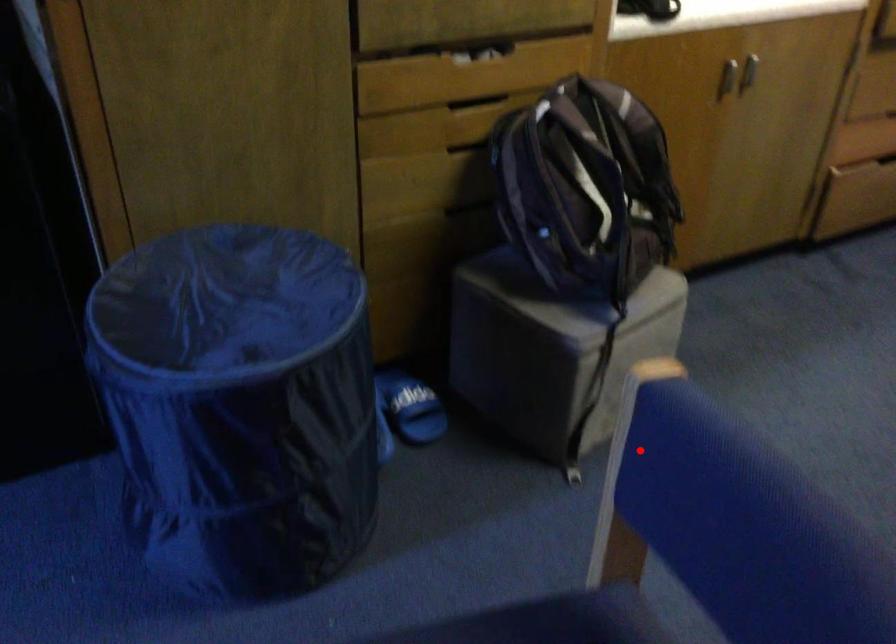
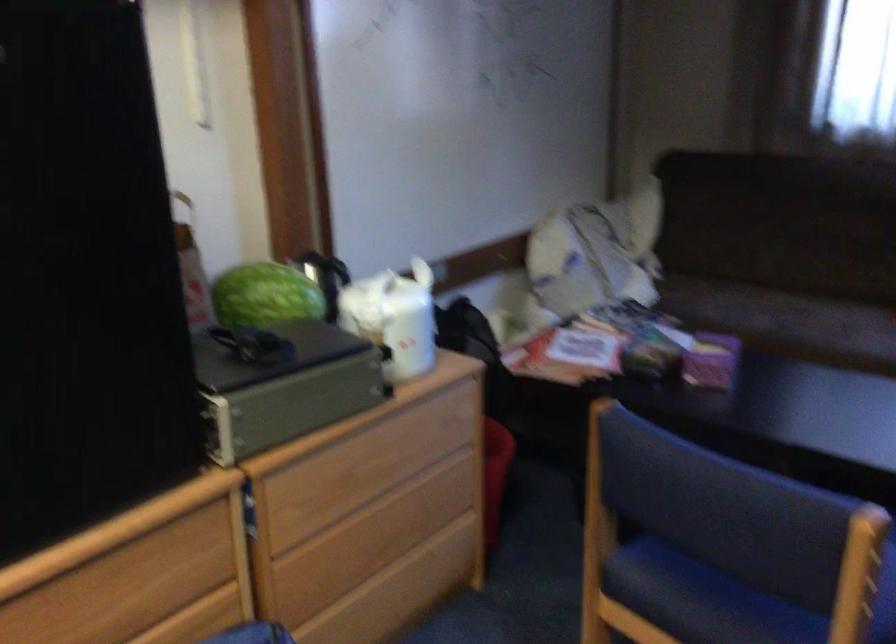
Question: I am providing you with two images of the same scene from different viewpoints. A red point is marked on the first image. Is the red point's position out of view in image 2?

Choices:
 (A) Yes
 (B) No

Answer: (B)